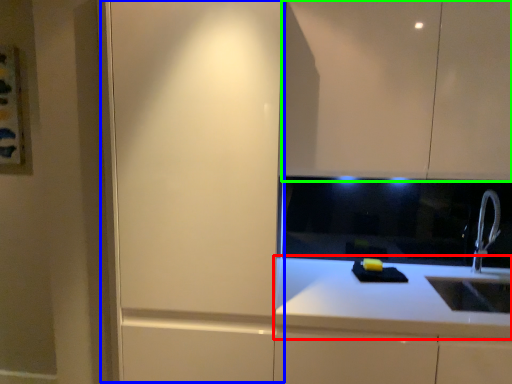
Question: Which object is the farthest from countertop (highlighted by a red box)? Choose among these: screen door (highlighted by a blue box) or cabinetry (highlighted by a green box).

Choices:
 (A) screen door
 (B) cabinetry

Answer: (B)